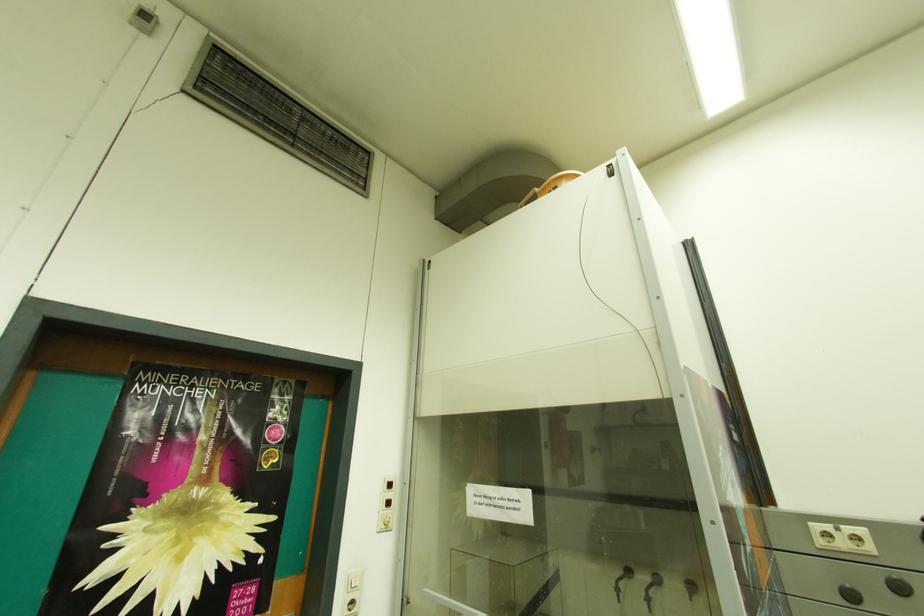
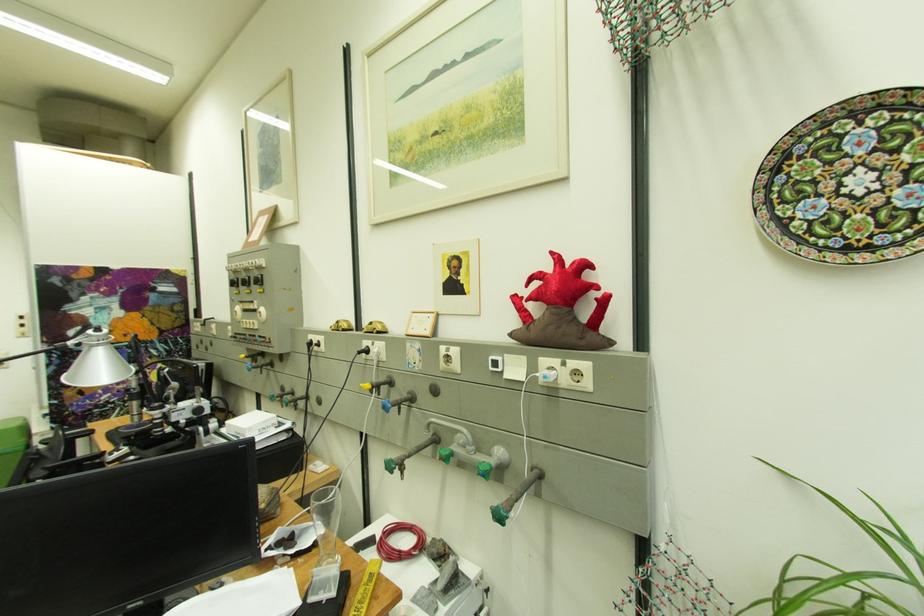
What movement of the cameraman would produce the second image?

The cameraman moved toward right, backward.